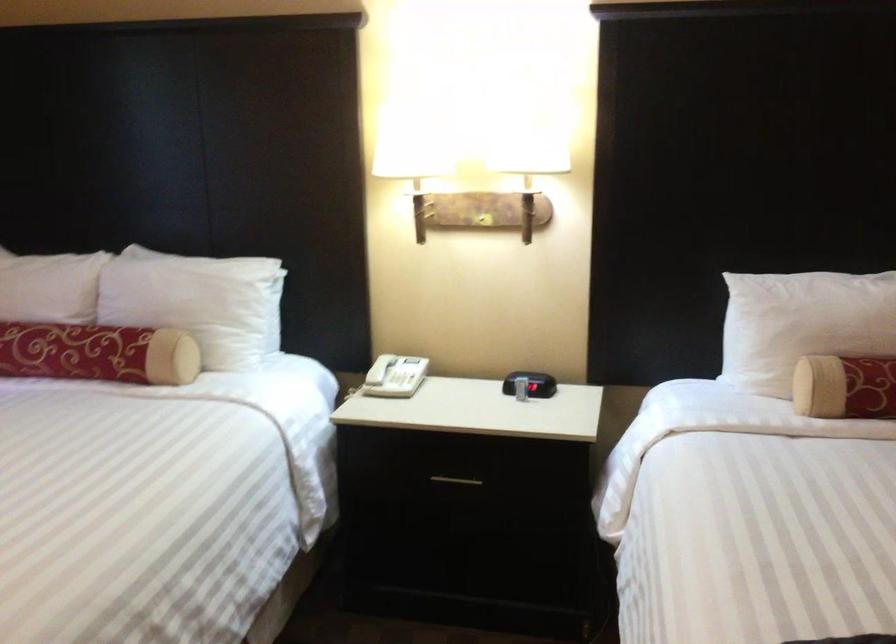
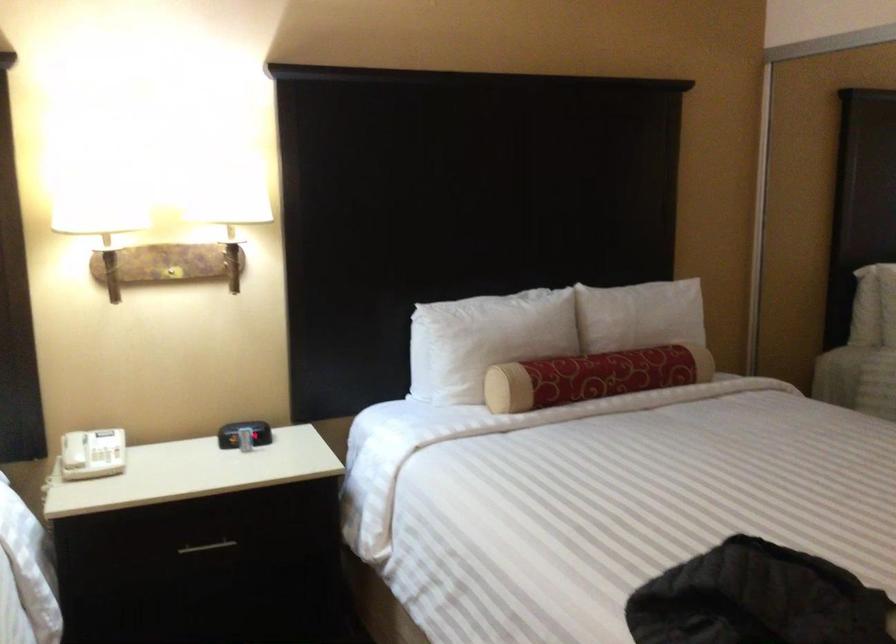
Locate, in the second image, the point that corresponds to pixel 483 216 in the first image.

(171, 272)